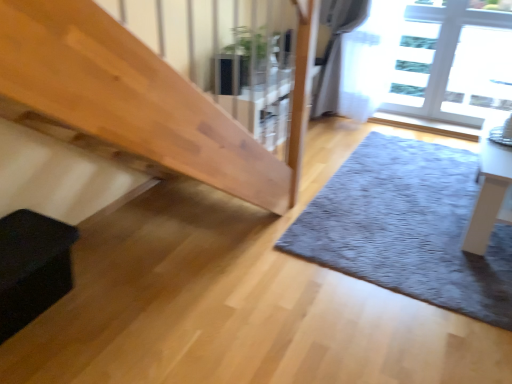
Describe the element at coordinates (32, 267) in the screenshot. The width and height of the screenshot is (512, 384). I see `black matte box at lower left` at that location.

Locate an element on the screen. Image resolution: width=512 pixels, height=384 pixels. black matte box at lower left is located at coordinates (32, 267).

Locate an element on the screen. The image size is (512, 384). gray shaggy rug at lower right is located at coordinates (408, 228).

Consider the image. Considering their positions, is black matte box at lower left located in front of or behind white glossy table at right?

black matte box at lower left is in front of white glossy table at right.

Is black matte box at lower left turned away from white glossy table at right?

No.

Looking at this image, between green glossy plant at upper center and gray shaggy rug at lower right, which one is positioned behind?

green glossy plant at upper center is behind.

From a real-world perspective, which is physically above, green glossy plant at upper center or gray shaggy rug at lower right?

green glossy plant at upper center, from a real-world perspective.

From the image's perspective, would you say green glossy plant at upper center is positioned over gray shaggy rug at lower right?

Indeed, from the image's perspective, green glossy plant at upper center is shown above gray shaggy rug at lower right.

In the image, there is a green glossy plant at upper center. Find the location of `mat below it (from the image's perspective)`. mat below it (from the image's perspective) is located at coordinates (408, 228).

In terms of height, does transparent glass window at upper right look taller or shorter compared to gray shaggy rug at lower right?

transparent glass window at upper right is taller than gray shaggy rug at lower right.

Considering the sizes of objects transparent glass window at upper right and gray shaggy rug at lower right in the image provided, who is wider, transparent glass window at upper right or gray shaggy rug at lower right?

gray shaggy rug at lower right.

In terms of size, does transparent glass window at upper right appear bigger or smaller than gray shaggy rug at lower right?

transparent glass window at upper right is smaller than gray shaggy rug at lower right.

Based on the photo, how far apart are transparent glass window at upper right and gray shaggy rug at lower right?

transparent glass window at upper right and gray shaggy rug at lower right are 4.61 feet apart from each other.

Considering the sizes of objects gray shaggy rug at lower right and transparent glass window at upper right in the image provided, who is thinner, gray shaggy rug at lower right or transparent glass window at upper right?

Thinner between the two is transparent glass window at upper right.

Between gray shaggy rug at lower right and transparent glass window at upper right, which one has larger size?

Bigger between the two is gray shaggy rug at lower right.

In the image, is gray shaggy rug at lower right on the left side or the right side of transparent glass window at upper right?

Based on their positions, gray shaggy rug at lower right is located to the left of transparent glass window at upper right.

Is green glossy plant at upper center positioned beyond the bounds of white glossy table at right?

Indeed, green glossy plant at upper center is completely outside white glossy table at right.

Is green glossy plant at upper center in front of white glossy table at right?

No, it is not.

Is point (258, 31) positioned before point (493, 165)?

No, (258, 31) is further to viewer.

Looking at this image, is green glossy plant at upper center touching white glossy table at right?

They are not placed beside each other.

At what (x,y) coordinates should I click in order to perform the action: click on plant that is above the black matte box at lower left (from the image's perspective). Please return your answer as a coordinate pair (x, y). Looking at the image, I should click on (255, 47).

Who is shorter, green glossy plant at upper center or black matte box at lower left?

With less height is black matte box at lower left.

From the image's perspective, which one is positioned lower, green glossy plant at upper center or black matte box at lower left?

black matte box at lower left.

Looking at this image, who is taller, green glossy plant at upper center or transparent glass window at upper right?

With more height is transparent glass window at upper right.

From the image's perspective, between green glossy plant at upper center and transparent glass window at upper right, which one is located above?

transparent glass window at upper right, from the image's perspective.

Is green glossy plant at upper center placed right next to transparent glass window at upper right?

No, green glossy plant at upper center is not next to transparent glass window at upper right.

Is green glossy plant at upper center outside of transparent glass window at upper right?

That's correct, green glossy plant at upper center is outside of transparent glass window at upper right.

In the image, there is a black matte box at lower left. Identify the location of table above it (from the image's perspective). The image size is (512, 384). (488, 188).

This screenshot has width=512, height=384. Find the location of `plant above the gray shaggy rug at lower right (from a real-world perspective)`. plant above the gray shaggy rug at lower right (from a real-world perspective) is located at coordinates 255,47.

Considering their positions, is gray shaggy rug at lower right positioned closer to white glossy table at right than green glossy plant at upper center?

gray shaggy rug at lower right is closer to white glossy table at right.

In the scene shown: Which object lies nearer to the anchor point green glossy plant at upper center, gray shaggy rug at lower right or white glossy table at right?

The object closer to green glossy plant at upper center is gray shaggy rug at lower right.

From the image, which object appears to be nearer to white glossy table at right, black matte box at lower left or gray shaggy rug at lower right?

The object closer to white glossy table at right is gray shaggy rug at lower right.

Based on their spatial positions, is black matte box at lower left or transparent glass window at upper right closer to white glossy table at right?

Based on the image, transparent glass window at upper right appears to be nearer to white glossy table at right.

Estimate the real-world distances between objects in this image. Which object is further from green glossy plant at upper center, black matte box at lower left or transparent glass window at upper right?

black matte box at lower left is positioned further to the anchor green glossy plant at upper center.

Estimate the real-world distances between objects in this image. Which object is further from black matte box at lower left, green glossy plant at upper center or transparent glass window at upper right?

transparent glass window at upper right is positioned further to the anchor black matte box at lower left.

Looking at the image, which one is located closer to white glossy table at right, green glossy plant at upper center or transparent glass window at upper right?

Among the two, transparent glass window at upper right is located nearer to white glossy table at right.

When comparing their distances from gray shaggy rug at lower right, does white glossy table at right or transparent glass window at upper right seem further?

transparent glass window at upper right.

Where is `window situated between green glossy plant at upper center and white glossy table at right from left to right`? The width and height of the screenshot is (512, 384). window situated between green glossy plant at upper center and white glossy table at right from left to right is located at coordinates (452, 64).

The height and width of the screenshot is (384, 512). Find the location of `window between black matte box at lower left and white glossy table at right`. window between black matte box at lower left and white glossy table at right is located at coordinates (452, 64).

I want to click on plant situated between black matte box at lower left and white glossy table at right from left to right, so click(x=255, y=47).

Where is `mat between green glossy plant at upper center and white glossy table at right from left to right`? The width and height of the screenshot is (512, 384). mat between green glossy plant at upper center and white glossy table at right from left to right is located at coordinates (408, 228).